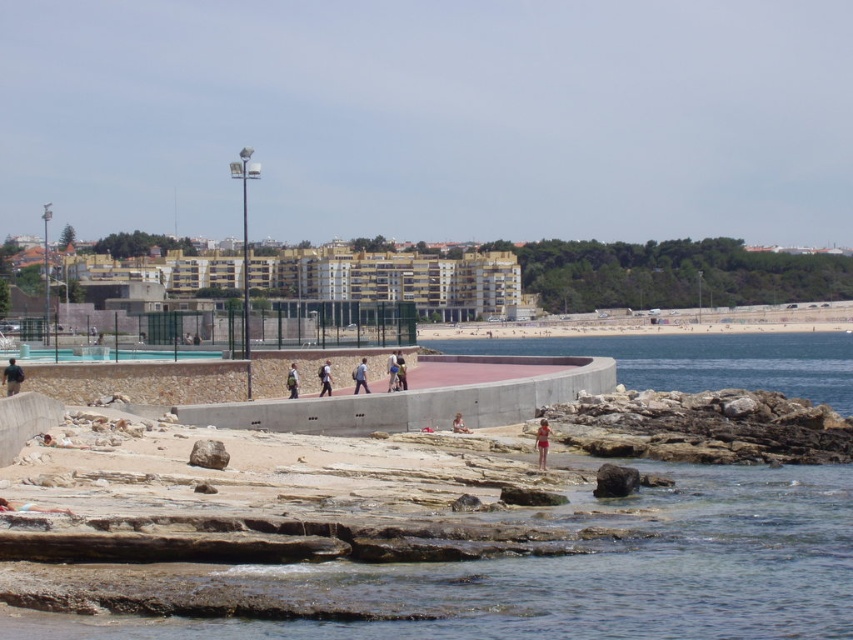
Which of these two, dark blue shirt at lower left or matte blue shirt at center, stands taller?

dark blue shirt at lower left

Does dark blue shirt at lower left have a greater width compared to matte blue shirt at center?

Indeed, dark blue shirt at lower left has a greater width compared to matte blue shirt at center.

Is point (22, 374) closer to camera compared to point (387, 385)?

That is True.

Where is `dark blue shirt at lower left`? dark blue shirt at lower left is located at coordinates (12, 378).

Is light blue denim shorts at center above matte blue shirt at center?

Correct, light blue denim shorts at center is located above matte blue shirt at center.

Between point (328, 390) and point (393, 374), which one is positioned in front?

Point (328, 390) is in front.

Between point (326, 388) and point (387, 388), which one is positioned behind?

The point (387, 388) is more distant.

You are a GUI agent. You are given a task and a screenshot of the screen. Output one action in this format:
    pyautogui.click(x=<x>, y=<y>)
    Task: Click on the light blue denim shorts at center
    The width and height of the screenshot is (853, 640).
    Given the screenshot: What is the action you would take?
    pyautogui.click(x=323, y=378)

Is red fabric swimsuit at center smaller than light blue denim shorts at center?

Yes, red fabric swimsuit at center is smaller than light blue denim shorts at center.

Is point (547, 449) positioned before point (322, 368)?

Yes, it is.

Locate an element on the screen. red fabric swimsuit at center is located at coordinates (543, 442).